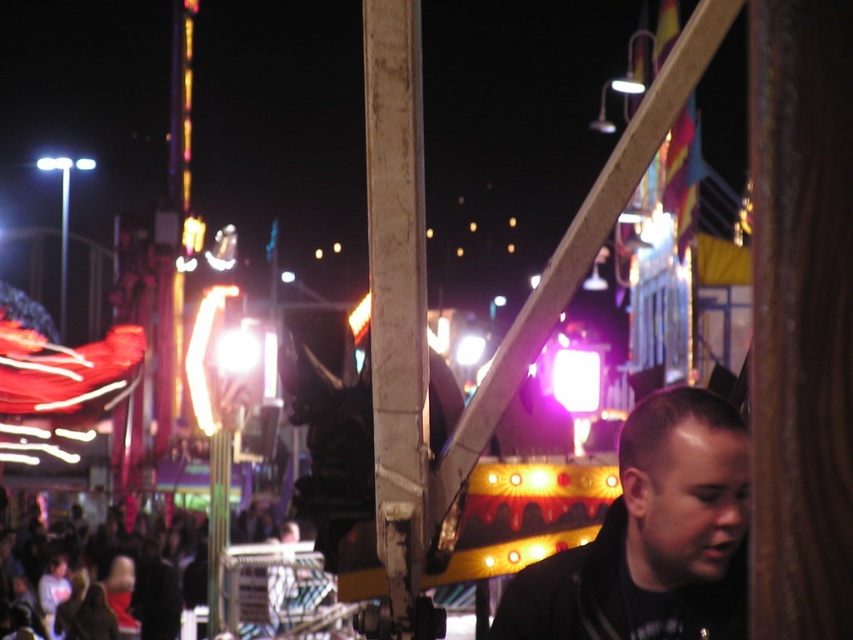
Does black matte jacket at lower right appear on the right side of white painted wood pole at center?

Yes, black matte jacket at lower right is to the right of white painted wood pole at center.

Measure the distance between black matte jacket at lower right and camera.

black matte jacket at lower right and camera are 36.60 meters apart from each other.

The width and height of the screenshot is (853, 640). Find the location of `black matte jacket at lower right`. black matte jacket at lower right is located at coordinates (653, 538).

Measure the distance from black matte jacket at lower right to dark clothing crowd at lower left.

A distance of 235.75 feet exists between black matte jacket at lower right and dark clothing crowd at lower left.

Is black matte jacket at lower right shorter than dark clothing crowd at lower left?

Correct, black matte jacket at lower right is not as tall as dark clothing crowd at lower left.

Is point (633, 451) closer to camera compared to point (128, 536)?

Yes, point (633, 451) is closer to viewer.

Identify the location of black matte jacket at lower right. The height and width of the screenshot is (640, 853). (653, 538).

From the picture: Does white painted wood pole at center have a lesser height compared to dark clothing crowd at lower left?

Incorrect, white painted wood pole at center's height does not fall short of dark clothing crowd at lower left's.

Who is more forward, [421,634] or [241,589]?

Point [421,634] is in front.

Where is `white painted wood pole at center`? white painted wood pole at center is located at coordinates (397, 310).